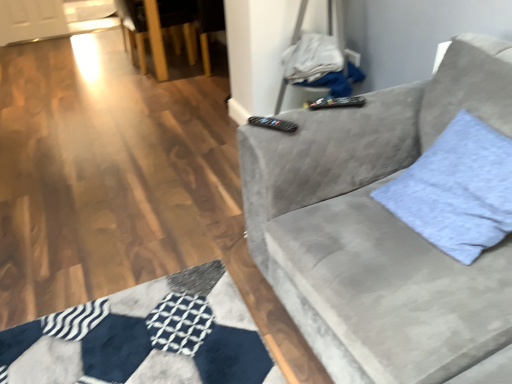
Question: Should I look upward or downward to see wooden armchair at upper left?

Choices:
 (A) up
 (B) down

Answer: (A)

Question: Is black plastic remote at upper center, the 1th remote viewed from the front, further to the viewer compared to velvet gray couch at right?

Choices:
 (A) yes
 (B) no

Answer: (A)

Question: Is black plastic remote at upper center, which appears as the 1th remote when ordered from the bottom, facing towards velvet gray couch at right?

Choices:
 (A) yes
 (B) no

Answer: (A)

Question: Is black plastic remote at upper center, which is the 2th remote in back-to-front order, to the left of velvet gray couch at right from the viewer's perspective?

Choices:
 (A) yes
 (B) no

Answer: (A)

Question: Considering the relative sizes of black plastic remote at upper center, which appears as the 1th remote when ordered from the bottom, and velvet gray couch at right in the image provided, is black plastic remote at upper center, which appears as the 1th remote when ordered from the bottom, wider than velvet gray couch at right?

Choices:
 (A) no
 (B) yes

Answer: (A)

Question: From a real-world perspective, is black plastic remote at upper center, the 1th remote viewed from the front, on top of velvet gray couch at right?

Choices:
 (A) yes
 (B) no

Answer: (A)

Question: Does black plastic remote at upper center, which is the 2th remote in back-to-front order, appear on the right side of velvet gray couch at right?

Choices:
 (A) no
 (B) yes

Answer: (A)

Question: Can you confirm if black plastic remote at upper center, which appears as the 1th remote when viewed from the top, is smaller than light blue fabric pillow at right?

Choices:
 (A) no
 (B) yes

Answer: (B)

Question: Considering the relative sizes of black plastic remote at upper center, which appears as the 1th remote when viewed from the back, and light blue fabric pillow at right in the image provided, is black plastic remote at upper center, which appears as the 1th remote when viewed from the back, shorter than light blue fabric pillow at right?

Choices:
 (A) yes
 (B) no

Answer: (A)

Question: Would you say light blue fabric pillow at right is part of black plastic remote at upper center, which appears as the 1th remote when viewed from the top,'s contents?

Choices:
 (A) yes
 (B) no

Answer: (B)

Question: Is black plastic remote at upper center, which ranks as the second remote in bottom-to-top order, located outside light blue fabric pillow at right?

Choices:
 (A) yes
 (B) no

Answer: (A)

Question: From a real-world perspective, is black plastic remote at upper center, placed as the 1th remote when sorted from right to left, over light blue fabric pillow at right?

Choices:
 (A) no
 (B) yes

Answer: (B)

Question: From the image's perspective, would you say black plastic remote at upper center, which ranks as the second remote in bottom-to-top order, is positioned over light blue fabric pillow at right?

Choices:
 (A) yes
 (B) no

Answer: (A)

Question: Is the position of black plastic remote at upper center, which is the 2th remote in back-to-front order, more distant than that of black plastic remote at upper center, the second remote when ordered from left to right?

Choices:
 (A) yes
 (B) no

Answer: (B)